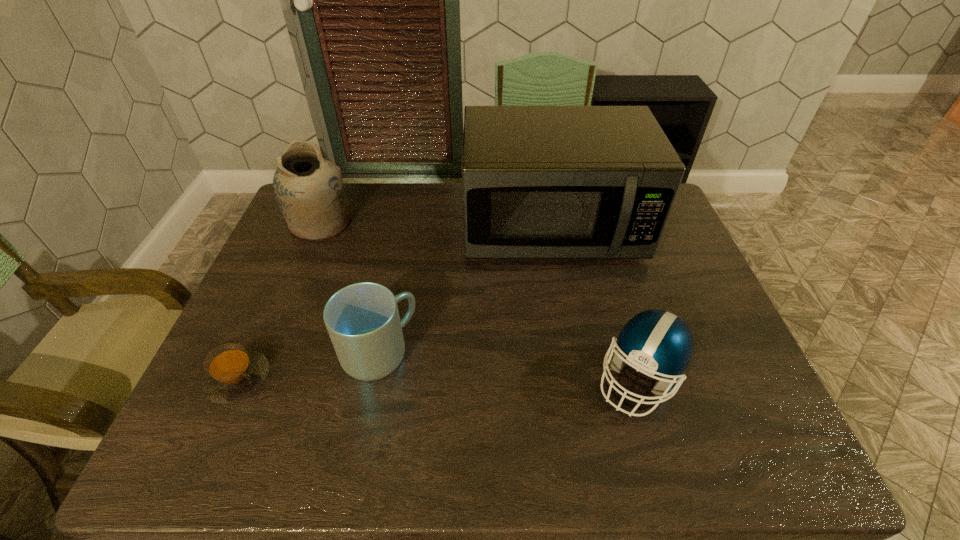
What are the coordinates of `the tallest object` in the screenshot? It's located at (538, 182).

Locate an element on the screen. pottery is located at coordinates (308, 189).

I want to click on the third object from right to left, so click(x=362, y=319).

This screenshot has width=960, height=540. Identify the location of football helmet. (655, 342).

Find the location of a particular element. This screenshot has width=960, height=540. the shortest object is located at coordinates (233, 373).

The height and width of the screenshot is (540, 960). In order to click on free space located 0.330m on the front-facing side of the microwave oven in this screenshot , I will do `click(578, 369)`.

The image size is (960, 540). What are the coordinates of `blank area located on the right of the pottery` in the screenshot? It's located at (460, 222).

The image size is (960, 540). What are the coordinates of `free location located on the right of the third object from left to right` in the screenshot? It's located at (516, 353).

Where is `free space located 0.050m at the front of the football helmet with the faceguard`? free space located 0.050m at the front of the football helmet with the faceguard is located at coordinates (659, 446).

At what (x,y) coordinates should I click in order to perform the action: click on vacant space located on the back of the shortest object. Please return your answer as a coordinate pair (x, y). Looking at the image, I should click on [x=289, y=265].